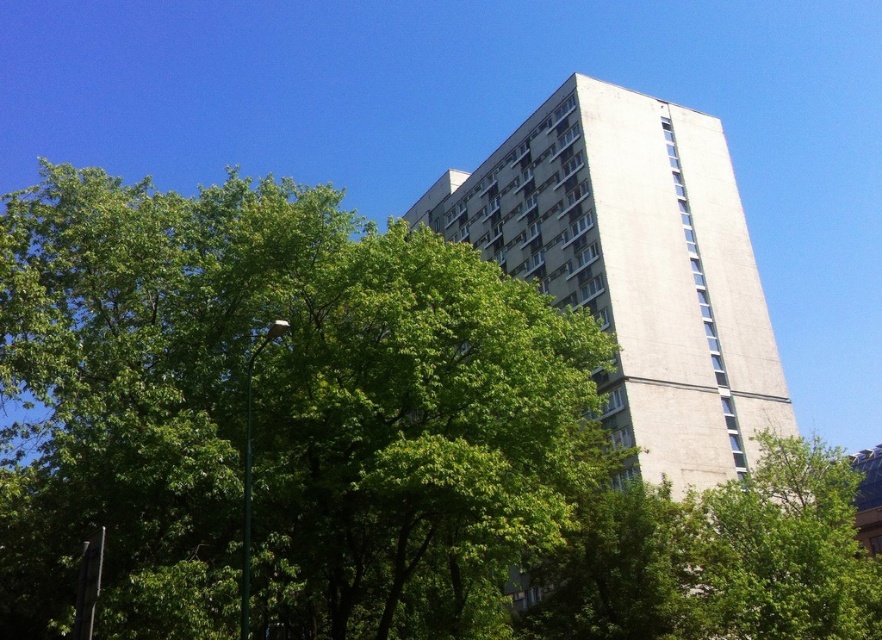
You are standing at the point marked as point (277, 413). What object is exactly at your current location?

The green leafy tree at center is located at point (277, 413).

You are standing at the origin point of the image coordinate system. The green leafy tree at center is located at point 0.648, 0.315. If you want to walk directly to the tree, which direction should you move in terms of x and y coordinates?

The green leafy tree at center is located at point (277, 413). Since the x coordinate is higher than 0.5, you should move to the right. The y coordinate is lower than 0.5, so you should move downward. Therefore, you should move to the right and downward to reach the tree.

You are a city planner analyzing the image. The green leafy tree at center and the white concrete building at center are both in the center of the image. Which one do you think is closer to the viewer?

The green leafy tree at center has a smaller size compared to the white concrete building at center, so the tree is closer to the viewer because objects that are smaller in the image are typically closer and appear larger, but in this case, the tree is smaller than the building, which might indicate it is farther away. Wait, this seems contradictory. Let me think again. In perspective, closer objects appear larger. If the tree is smaller than the building but both are at center, maybe the building is closer